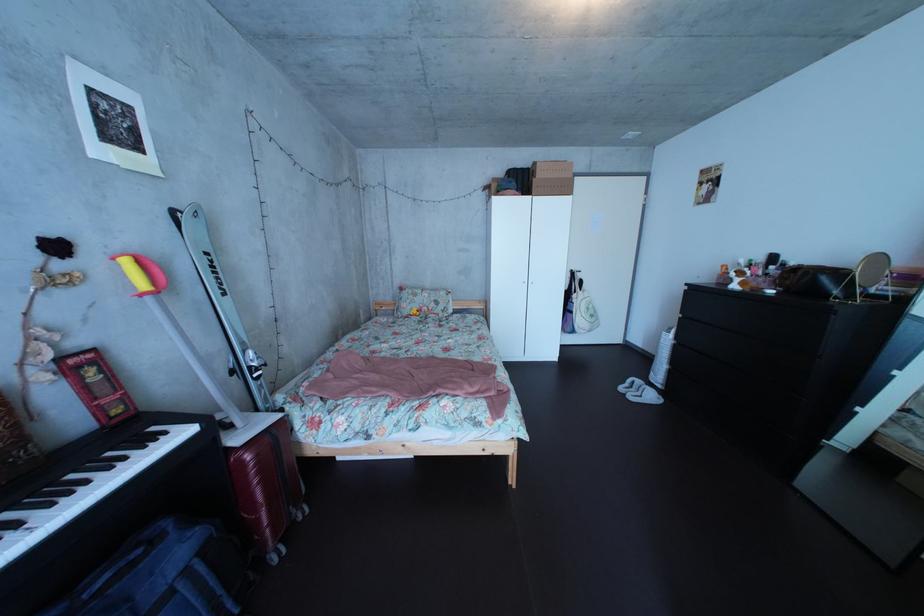
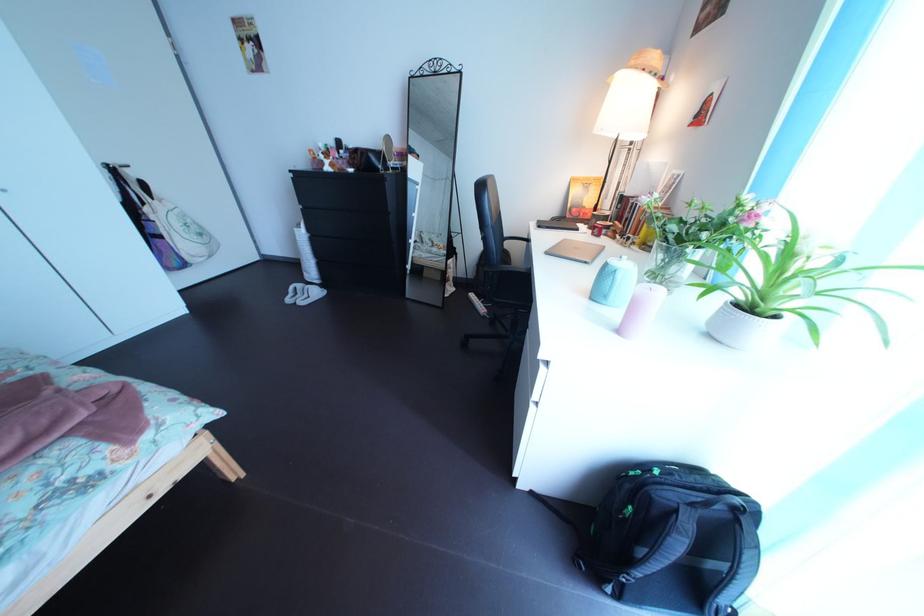
First-person continuous shooting, in which direction is the camera rotating?

The camera rotated toward right-down.